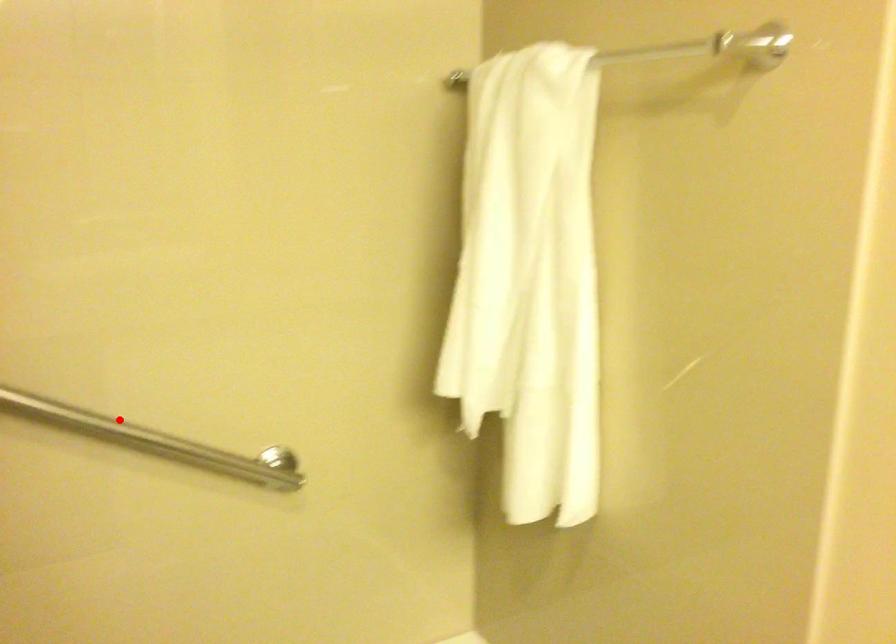
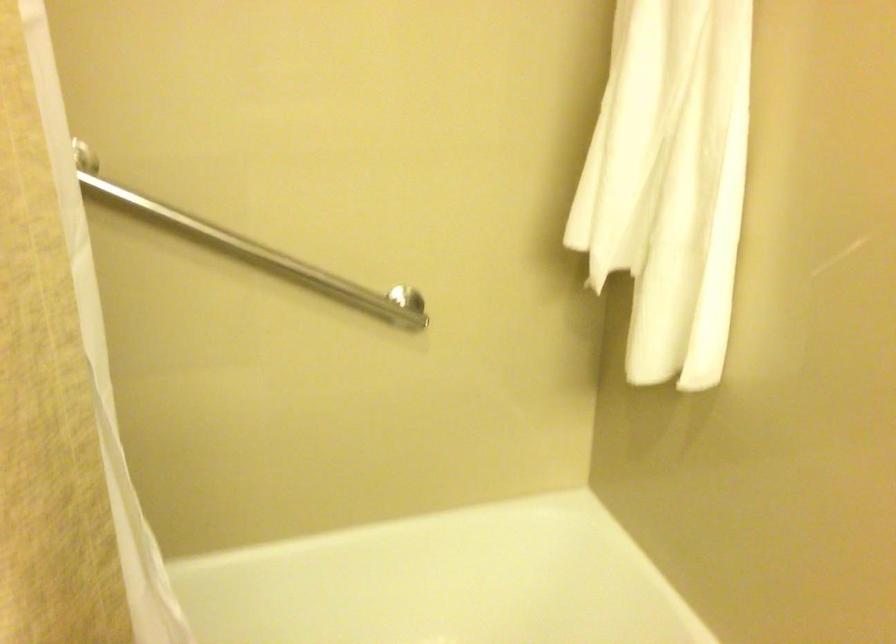
Where in the second image is the point corresponding to the highlighted location from the first image?

(256, 251)